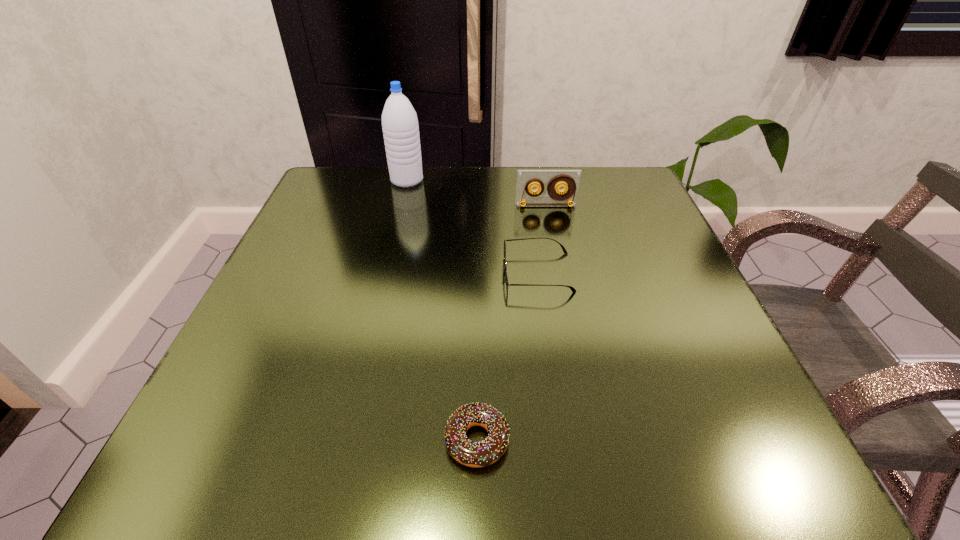
At what (x,y) coordinates should I click in order to perform the action: click on vacant area that lies between the nearest object and the videotape. Please return your answer as a coordinate pair (x, y). The width and height of the screenshot is (960, 540). Looking at the image, I should click on (512, 322).

The image size is (960, 540). What are the coordinates of `free point between the farthest object and the spectacles` in the screenshot? It's located at (472, 226).

Where is `object that is the third closest to the doughnut`? object that is the third closest to the doughnut is located at coordinates (400, 127).

In order to click on the second closest object to the videotape in this screenshot , I will do (x=400, y=127).

Where is `blank space that satisfies the following two spatial constraints: 1. at the front of the second farthest object with visible reels; 2. on the front-facing side of the spectacles`? This screenshot has height=540, width=960. blank space that satisfies the following two spatial constraints: 1. at the front of the second farthest object with visible reels; 2. on the front-facing side of the spectacles is located at coordinates [559, 272].

Where is `free location that satisfies the following two spatial constraints: 1. at the front of the second farthest object with visible reels; 2. on the front-facing side of the spectacles`? This screenshot has width=960, height=540. free location that satisfies the following two spatial constraints: 1. at the front of the second farthest object with visible reels; 2. on the front-facing side of the spectacles is located at coordinates (559, 272).

This screenshot has height=540, width=960. I want to click on vacant space that satisfies the following two spatial constraints: 1. at the front of the second tallest object with visible reels; 2. on the front-facing side of the spectacles, so click(x=559, y=272).

Locate an element on the screen. This screenshot has width=960, height=540. free point that satisfies the following two spatial constraints: 1. at the front of the videotape with visible reels; 2. on the front-facing side of the spectacles is located at coordinates (559, 272).

Identify the location of vacant position in the image that satisfies the following two spatial constraints: 1. on the front-facing side of the third farthest object; 2. on the front side of the doughnut. (562, 440).